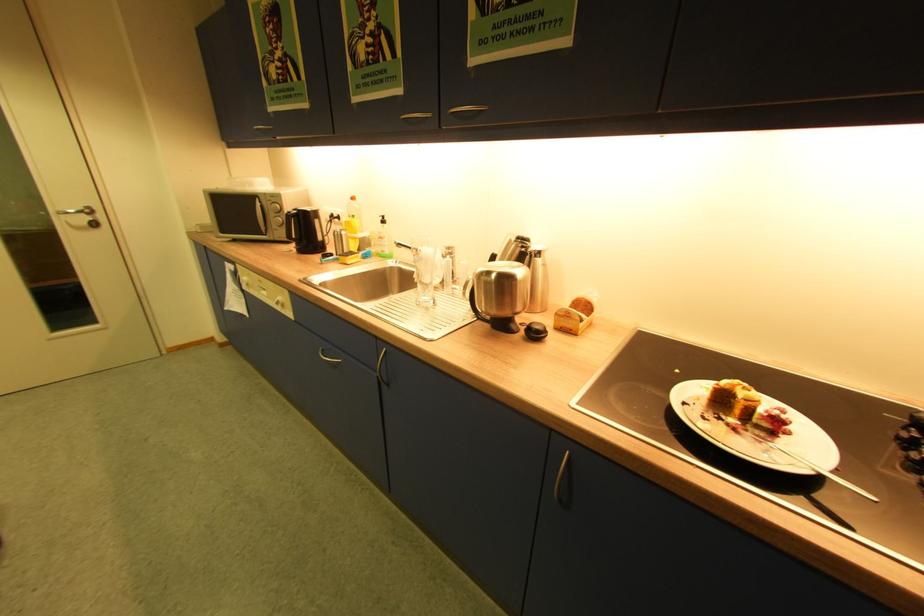
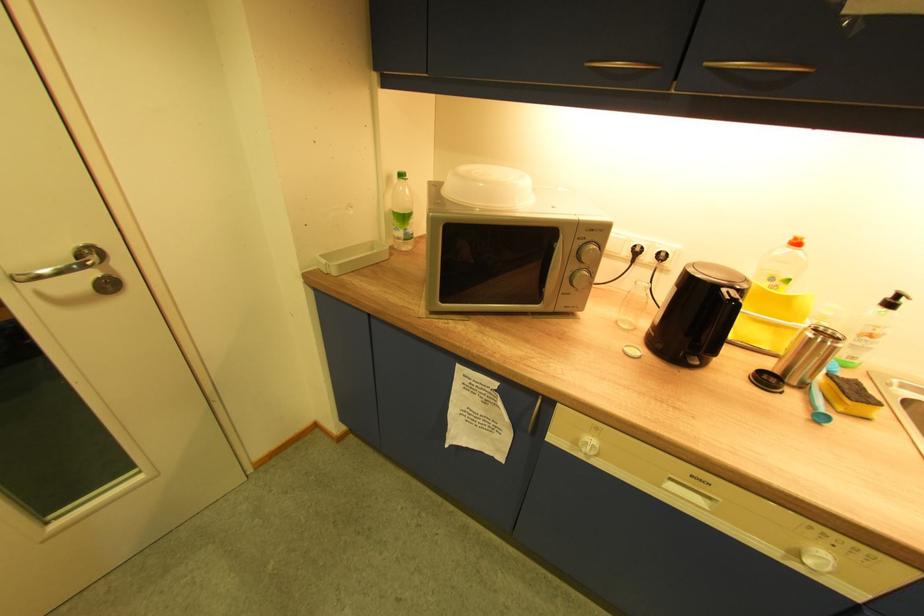
In the second image, find the point that corresponds to [359,199] in the first image.

(803, 244)